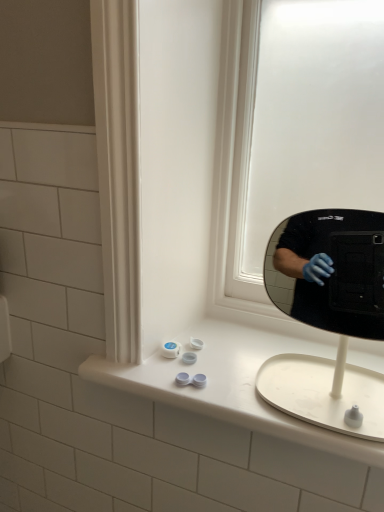
Locate an element on the screen. Image resolution: width=384 pixels, height=512 pixels. free spot above white matte counter top at center (from a real-world perspective) is located at coordinates (249, 356).